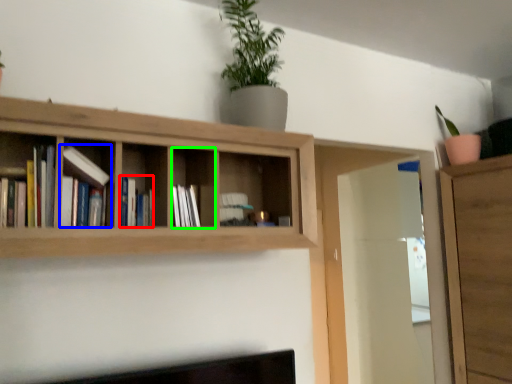
Question: Based on their relative distances, which object is nearer to book (highlighted by a red box)? Choose from book (highlighted by a blue box) and cabinet (highlighted by a green box).

Choices:
 (A) book
 (B) cabinet

Answer: (A)